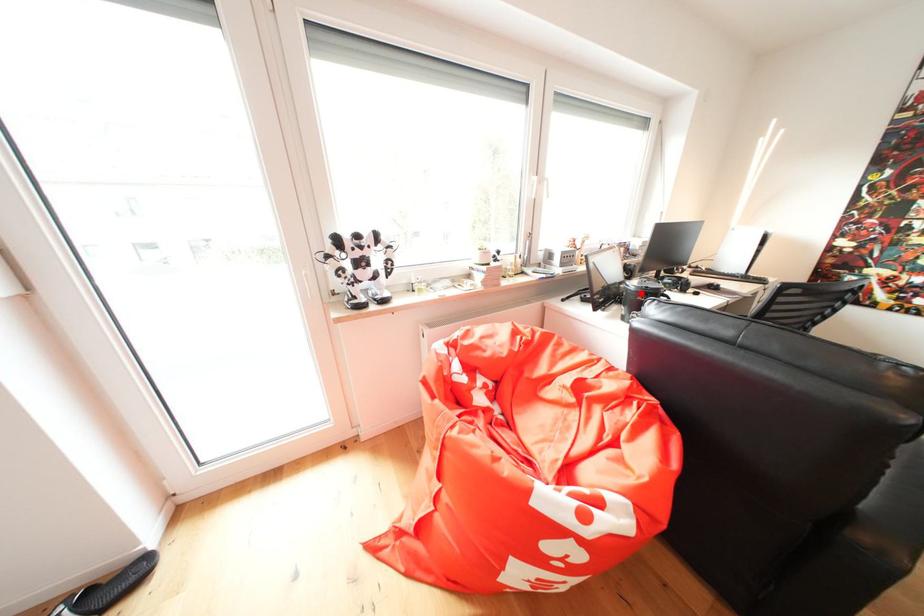
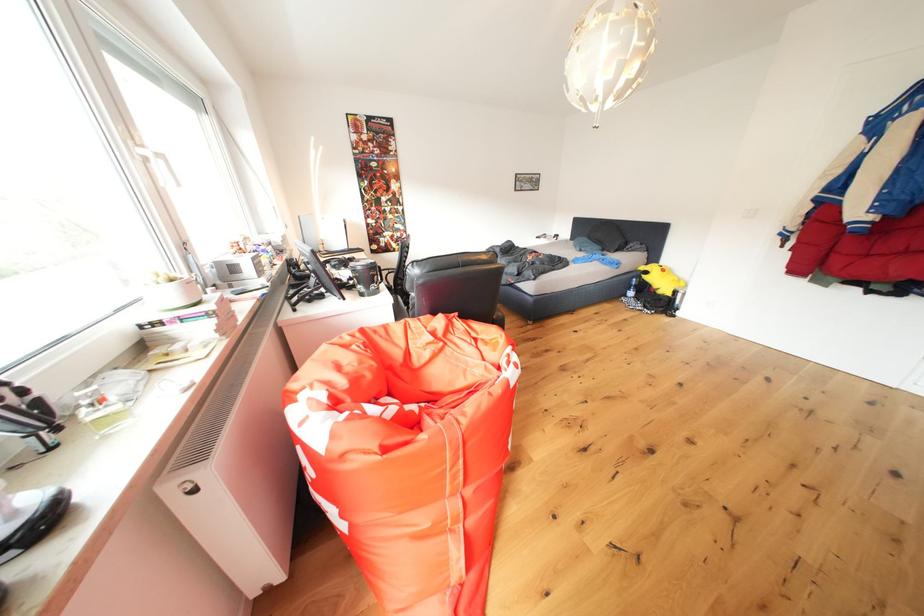
Question: A red point is marked in image1. In image2, is the corresponding 3D point closer to the camera or farther? Reply with the corresponding letter.

Choices:
 (A) The corresponding 3D point is closer.
 (B) The corresponding 3D point is farther.

Answer: (A)